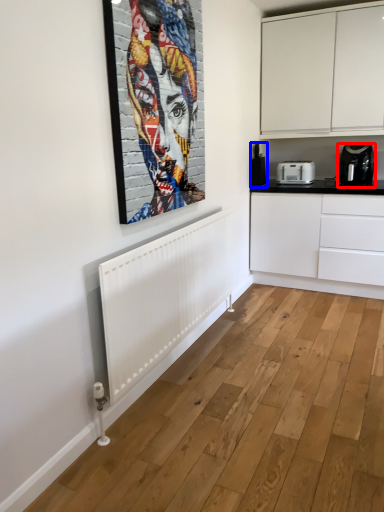
Question: Which object is closer to the camera taking this photo, home appliance (highlighted by a red box) or coffee machine (highlighted by a blue box)?

Choices:
 (A) home appliance
 (B) coffee machine

Answer: (A)